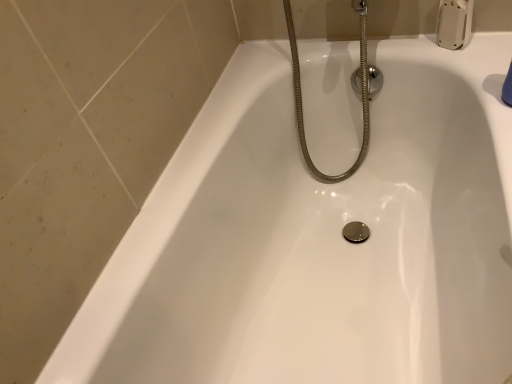
Based on the photo, in order to face satin nickel hose at center, should I rotate leftwards or rightwards?

Rotate your view right by about 11.822°.

This screenshot has width=512, height=384. What do you see at coordinates (360, 91) in the screenshot? I see `satin nickel hose at center` at bounding box center [360, 91].

You are a GUI agent. You are given a task and a screenshot of the screen. Output one action in this format:
    pyautogui.click(x=<x>, y=<y>)
    Task: Click on the satin nickel hose at center
    
    Given the screenshot: What is the action you would take?
    pyautogui.click(x=360, y=91)

Find the location of a particular element. satin nickel hose at center is located at coordinates (360, 91).